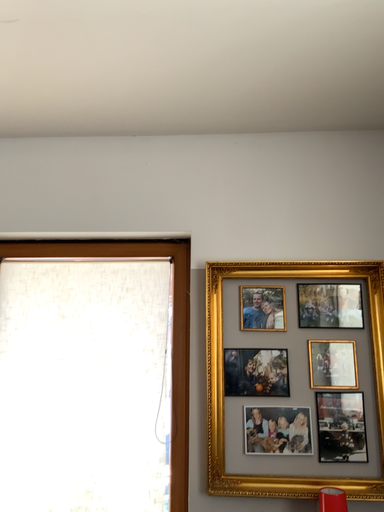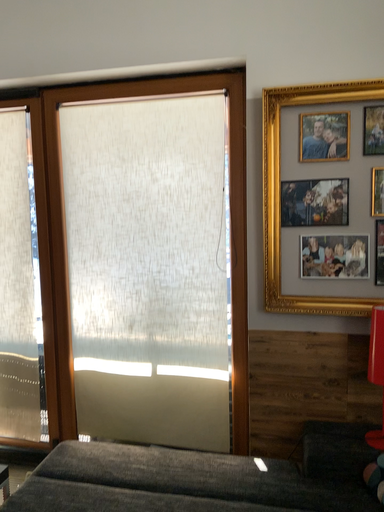
Question: How did the camera likely rotate when shooting the video?

Choices:
 (A) rotated upward
 (B) rotated downward

Answer: (B)